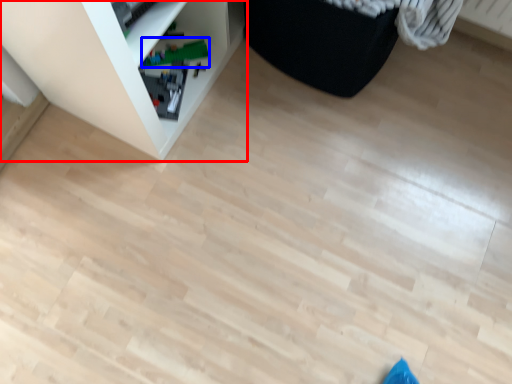
Question: Among these objects, which one is nearest to the camera, shelf (highlighted by a red box) or toy (highlighted by a blue box)?

Choices:
 (A) shelf
 (B) toy

Answer: (A)